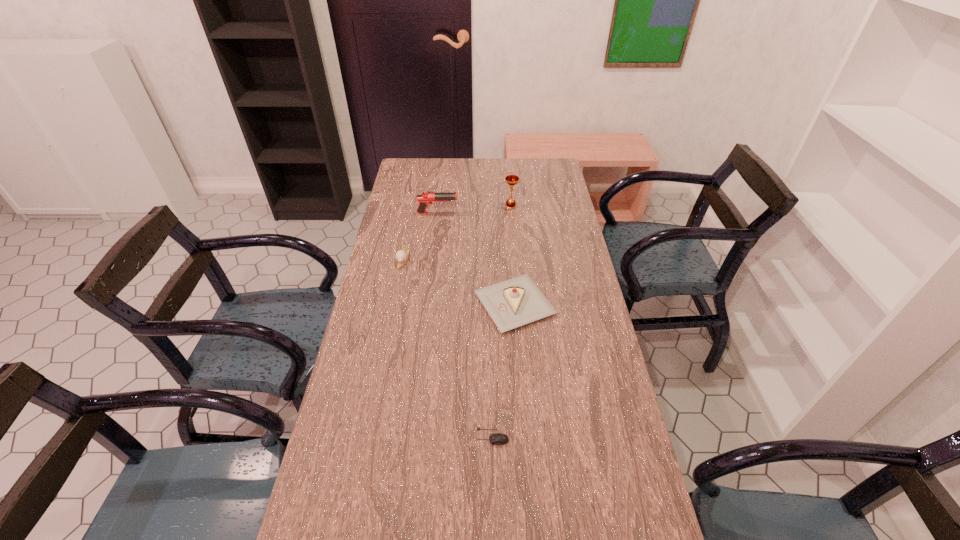
This screenshot has width=960, height=540. I want to click on chalice, so click(x=511, y=180).

In order to click on the tallest object in this screenshot , I will do `click(511, 180)`.

The image size is (960, 540). In order to click on the second tallest object in this screenshot , I will do `click(425, 198)`.

Where is `the fourth nearest object`? The image size is (960, 540). the fourth nearest object is located at coordinates pos(425,198).

Image resolution: width=960 pixels, height=540 pixels. I want to click on cake, so click(x=513, y=303).

Where is `the fourth farthest object`? This screenshot has width=960, height=540. the fourth farthest object is located at coordinates (513, 303).

Where is `escargot`? This screenshot has width=960, height=540. escargot is located at coordinates (401, 256).

Identify the location of the third nearest object. (401, 256).

Where is `the nearest object`? the nearest object is located at coordinates (495, 439).

Find the location of a particular element. Image resolution: width=960 pixels, height=540 pixels. the shortest object is located at coordinates click(x=495, y=439).